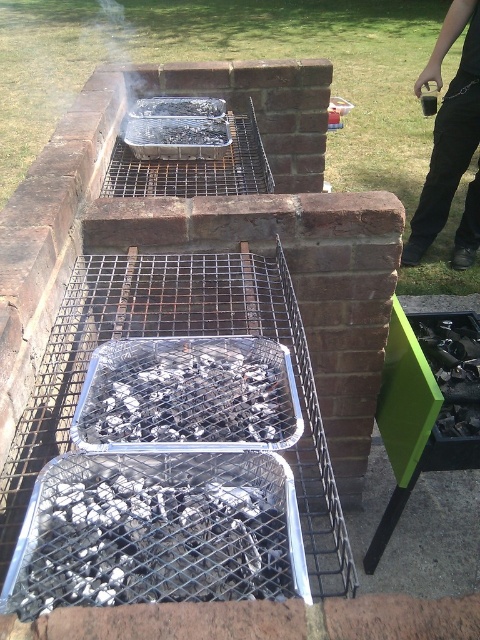
You are standing at the charcoal ash at center and want to reach the black pants at right. Given that the distance between them is 2.92 meters, how many steps would you need to take if each step covers 0.75 meters?

The distance between the charcoal ash at center and black pants at right is 2.92 meters. Each step covers 0.75 meters, so dividing 2.92 by 0.75 gives approximately 3.89 steps. Since you can only take whole steps, you would need 4 steps to reach the black pants at right.

You are a guest at a barbecue party and want to place a new charcoal briquette container to the left of the existing green container. Where should you put it in relation to the charcoal ash at center and the black pants at right?

The charcoal ash at center is to the left of the black pants at right, so to place the new charcoal briquette container to the left of the existing green container, you should put it to the left of the charcoal ash at center.